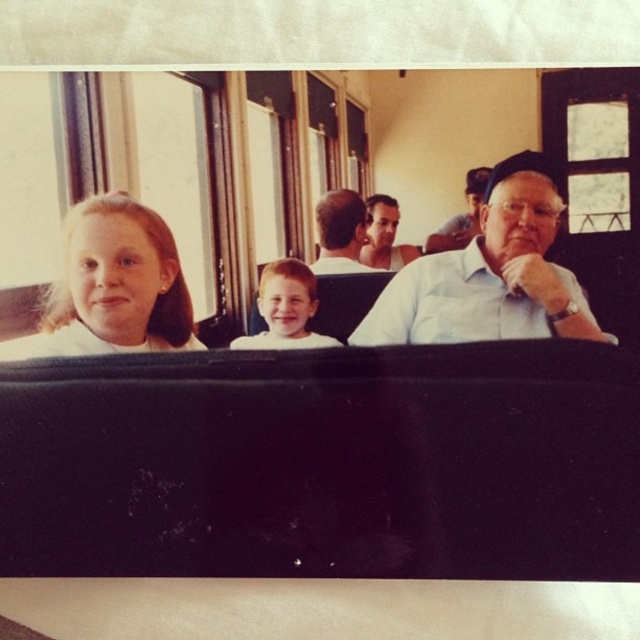
Question: Can you confirm if blonde hair at left is positioned below smooth brown hair at center?

Choices:
 (A) yes
 (B) no

Answer: (A)

Question: Does blonde hair at left appear on the right side of smooth brown hair at center?

Choices:
 (A) yes
 (B) no

Answer: (B)

Question: Which point appears farthest from the camera in this image?

Choices:
 (A) (333, 339)
 (B) (396, 220)
 (C) (552, 307)

Answer: (A)

Question: Is light blue shirt at center below smooth brown hair at center?

Choices:
 (A) yes
 (B) no

Answer: (A)

Question: Which point is farther from the camera taking this photo?

Choices:
 (A) (150, 230)
 (B) (572, 292)
 (C) (403, 266)
 (D) (323, 196)

Answer: (C)

Question: Which point is closer to the camera?

Choices:
 (A) (296, 298)
 (B) (60, 304)
 (C) (364, 323)

Answer: (B)